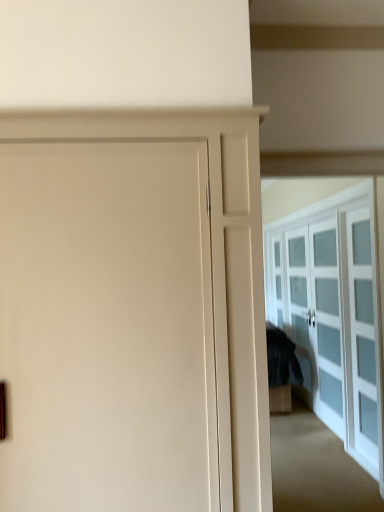
Describe the element at coordinates (107, 327) in the screenshot. The width and height of the screenshot is (384, 512). I see `matte white door at center` at that location.

Identify the location of matte white door at center. The image size is (384, 512). (107, 327).

Measure the distance between white glass cabinet at right and camera.

The distance of white glass cabinet at right from camera is 11.34 feet.

Consider the image. What is the approximate height of white glass cabinet at right?

white glass cabinet at right is 6.53 feet tall.

Where is `white glass cabinet at right`? The height and width of the screenshot is (512, 384). white glass cabinet at right is located at coordinates (319, 315).

What do you see at coordinates (319, 315) in the screenshot? I see `white glass cabinet at right` at bounding box center [319, 315].

Identify the location of matte white door at center. The width and height of the screenshot is (384, 512). (107, 327).

Can you confirm if matte white door at center is positioned to the right of white glass cabinet at right?

No.

Consider the image. Is matte white door at center further to the viewer compared to white glass cabinet at right?

No.

Does point (59, 360) come behind point (309, 233)?

No.

From the image's perspective, is matte white door at center located above white glass cabinet at right?

Indeed, from the image's perspective, matte white door at center is shown above white glass cabinet at right.

Consider the image. From a real-world perspective, is matte white door at center over white glass cabinet at right?

Yes, from a real-world perspective, matte white door at center is above white glass cabinet at right.

Can you confirm if matte white door at center is thinner than white glass cabinet at right?

In fact, matte white door at center might be wider than white glass cabinet at right.

Does matte white door at center have a lesser height compared to white glass cabinet at right?

In fact, matte white door at center may be taller than white glass cabinet at right.

Who is smaller, matte white door at center or white glass cabinet at right?

white glass cabinet at right is smaller.

Is matte white door at center located outside white glass cabinet at right?

Yes.

Are matte white door at center and white glass cabinet at right located far from each other?

Yes, matte white door at center is far from white glass cabinet at right.

Could you tell me if matte white door at center is turned towards white glass cabinet at right?

No, matte white door at center is not facing towards white glass cabinet at right.

Locate an element on the screen. This screenshot has height=512, width=384. screen door located underneath the matte white door at center (from a real-world perspective) is located at coordinates (319, 315).

Between white glass cabinet at right and matte white door at center, which one appears on the right side from the viewer's perspective?

white glass cabinet at right is more to the right.

Between white glass cabinet at right and matte white door at center, which one is positioned in front?

matte white door at center is in front.

Is point (336, 360) positioned in front of point (108, 489)?

No, (336, 360) is further to viewer.

From the image's perspective, between white glass cabinet at right and matte white door at center, who is located below?

From the image's view, white glass cabinet at right is below.

From a real-world perspective, which is physically above, white glass cabinet at right or matte white door at center?

In real-world perspective, matte white door at center is above.

Looking at their sizes, would you say white glass cabinet at right is wider or thinner than matte white door at center?

white glass cabinet at right is thinner than matte white door at center.

Does white glass cabinet at right have a lesser height compared to matte white door at center?

Correct, white glass cabinet at right is not as tall as matte white door at center.

Considering the sizes of objects white glass cabinet at right and matte white door at center in the image provided, who is smaller, white glass cabinet at right or matte white door at center?

white glass cabinet at right.

Can matte white door at center be found inside white glass cabinet at right?

No, matte white door at center is not inside white glass cabinet at right.

Is white glass cabinet at right not near matte white door at center?

Yes, white glass cabinet at right and matte white door at center are located far from each other.

Could you tell me if white glass cabinet at right is facing matte white door at center?

No, white glass cabinet at right is not facing towards matte white door at center.

How different are the orientations of white glass cabinet at right and matte white door at center in degrees?

The facing directions of white glass cabinet at right and matte white door at center are 90.2 degrees apart.

Find the location of `screen door that is behind the matte white door at center`. screen door that is behind the matte white door at center is located at coordinates point(319,315).

Locate an element on the screen. door on the left of white glass cabinet at right is located at coordinates (107, 327).

Find the location of a particular element. The height and width of the screenshot is (512, 384). screen door behind the matte white door at center is located at coordinates (319, 315).